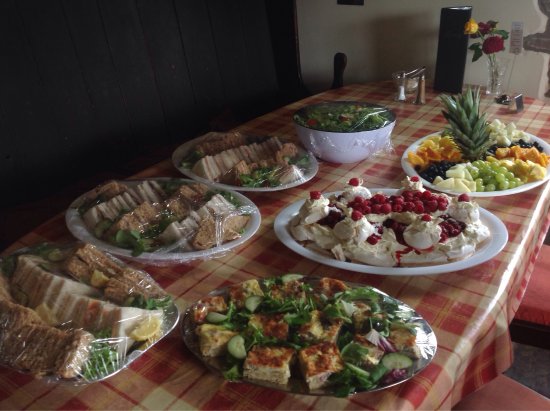
Find the location of a particular element. This screenshot has width=550, height=411. green wall is located at coordinates (59, 42), (197, 26).